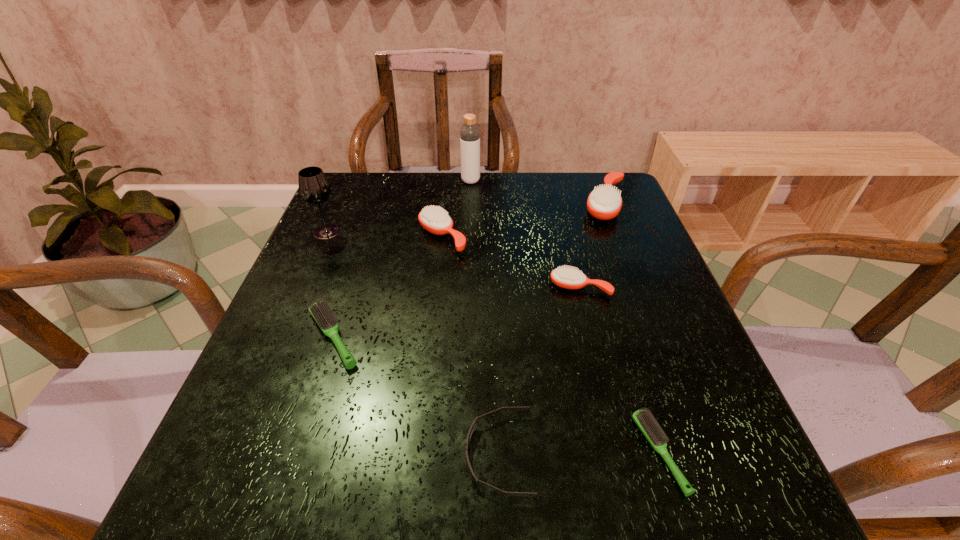
This screenshot has height=540, width=960. In order to click on the closest hairbrush to the second hairbrush from left to right in this screenshot , I will do `click(321, 312)`.

This screenshot has height=540, width=960. Find the location of `the closest orange hairbrush to the tallest hairbrush`. the closest orange hairbrush to the tallest hairbrush is located at coordinates (570, 278).

Locate an element on the screen. orange hairbrush that is the closest one to the shortest hairbrush is located at coordinates (570, 278).